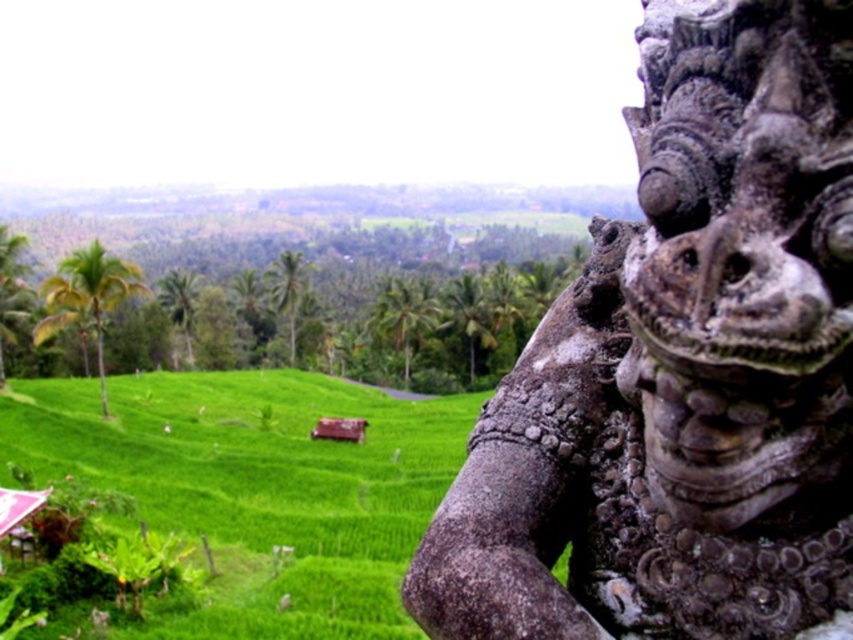
You are standing at the base of the rice terraces and want to reach both the point at the top of the image at coordinates point (682, 340) and the point near the palm trees at coordinates point (262, 458). Which point will you reach first as you walk forward?

You will reach the point at the top of the image at coordinates point (682, 340) first because it is closer to you than the point near the palm trees at coordinates point (262, 458).

You are standing at the center of the rice terraces and want to take a photo that includes both the gray stone statue at right and the green grassy hillside at lower left. Which object should you position closer to the camera to ensure both are in the frame?

You should position the gray stone statue at right closer to the camera because it is already in front of the green grassy hillside at lower left, so adjusting its position would help frame both objects effectively.

You are a landscape architect designing a walking path that needs to pass between the gray stone statue at right and the green grassy hillside at lower left. Considering their widths, which object requires a narrower path to navigate around it?

The gray stone statue at right has a lesser width compared to the green grassy hillside at lower left, so the path around the gray stone statue at right would need to be narrower than the one around the green grassy hillside at lower left.